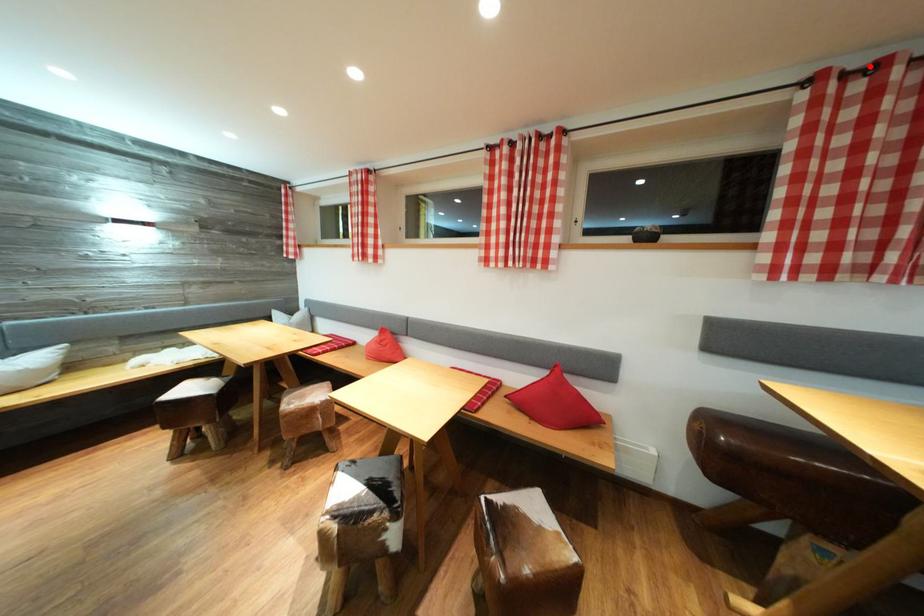
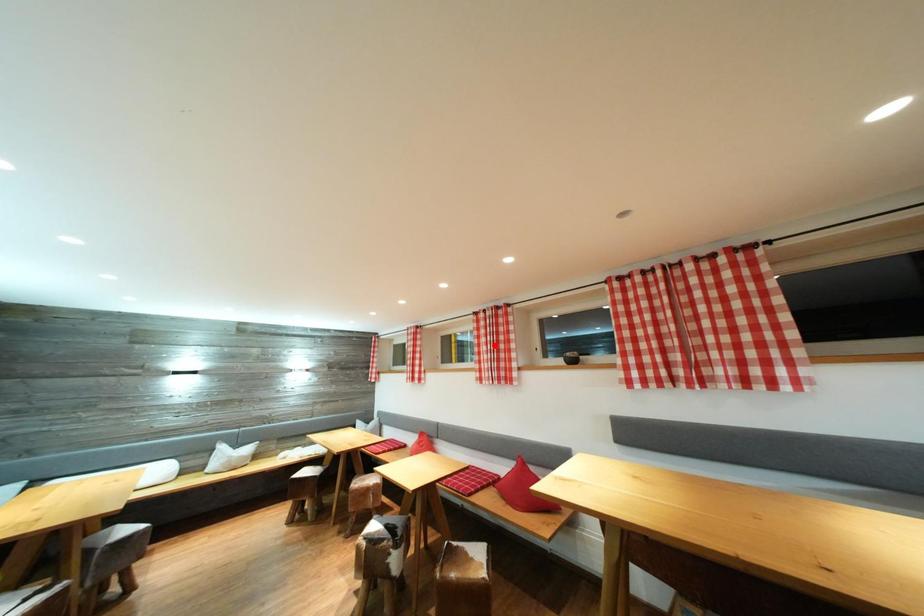
I am providing you with two images of the same scene from different viewpoints. A red point is marked on the first image and another point is marked on the second image. Is the red point in image1 aligned with the point shown in image2?

No